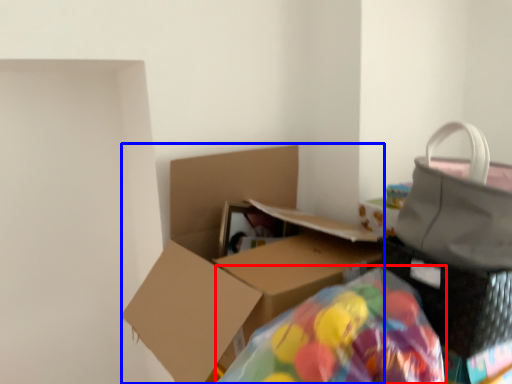
Question: Which point is further to the camera, bean bag chair (highlighted by a red box) or box (highlighted by a blue box)?

Choices:
 (A) bean bag chair
 (B) box

Answer: (B)